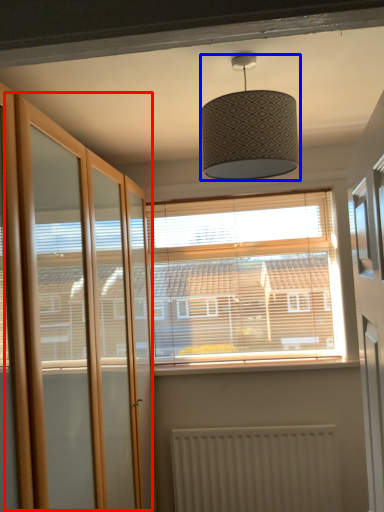
Question: Which point is further to the camera, screen door (highlighted by a red box) or lamp (highlighted by a blue box)?

Choices:
 (A) screen door
 (B) lamp

Answer: (B)